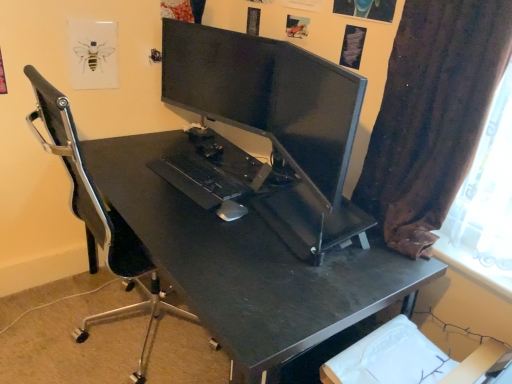
The height and width of the screenshot is (384, 512). What do you see at coordinates (250, 268) in the screenshot? I see `black matte desk at center` at bounding box center [250, 268].

You are a GUI agent. You are given a task and a screenshot of the screen. Output one action in this format:
    pyautogui.click(x=<x>, y=<y>)
    Task: Click on the white matte mouse at center
    The width and height of the screenshot is (512, 384).
    Given the screenshot: What is the action you would take?
    pyautogui.click(x=231, y=211)

At what (x,y) coordinates should I click in order to perform the action: click on black matte desk at center. Please return your answer as a coordinate pair (x, y). Looking at the image, I should click on (250, 268).

From a real-world perspective, is brown fabric curtain at right below black matte desk at center?

No, from a real-world perspective, brown fabric curtain at right is not below black matte desk at center.

Can you confirm if brown fabric curtain at right is taller than black matte desk at center?

Correct, brown fabric curtain at right is much taller as black matte desk at center.

Visually, is brown fabric curtain at right positioned to the left or to the right of black matte desk at center?

brown fabric curtain at right is to the right of black matte desk at center.

The width and height of the screenshot is (512, 384). I want to click on curtain on the right of black matte desk at center, so click(432, 115).

Which is correct: black matte desk at center is inside brown fabric curtain at right, or outside of it?

black matte desk at center is not inside brown fabric curtain at right, it's outside.

Considering the points (309, 271) and (376, 186), which point is in front, point (309, 271) or point (376, 186)?

The point (309, 271) is in front.

From a real-world perspective, relative to brown fabric curtain at right, is black matte desk at center vertically above or below?

black matte desk at center is situated lower than brown fabric curtain at right in the real world.

Considering the relative positions of black matte desk at center and brown fabric curtain at right in the image provided, is black matte desk at center to the left of brown fabric curtain at right from the viewer's perspective?

Yes.

Is brown fabric curtain at right aimed at white matte mouse at center?

No, brown fabric curtain at right is not aimed at white matte mouse at center.

Between brown fabric curtain at right and white matte mouse at center, which one has larger size?

With larger size is brown fabric curtain at right.

From the image's perspective, which object appears higher, brown fabric curtain at right or white matte mouse at center?

brown fabric curtain at right is shown above in the image.

How far apart are brown fabric curtain at right and white matte mouse at center?

brown fabric curtain at right and white matte mouse at center are 26.55 inches apart from each other.

Can you confirm if black matte desk at center is thinner than white matte mouse at center?

In fact, black matte desk at center might be wider than white matte mouse at center.

In the scene shown: From a real-world perspective, is black matte desk at center beneath white matte mouse at center?

Yes.

Would you say black matte desk at center is a long distance from white matte mouse at center?

No, black matte desk at center is in close proximity to white matte mouse at center.

Is white matte mouse at center aimed at black matte desk at center?

No.

Is white matte mouse at center in front of or behind black matte desk at center in the image?

white matte mouse at center is positioned farther from the viewer than black matte desk at center.

Based on the photo, how different are the orientations of white matte mouse at center and black matte desk at center in degrees?

The facing directions of white matte mouse at center and black matte desk at center are 3.03 degrees apart.

Identify the location of mouse above the black matte desk at center (from the image's perspective). (231, 211).

The width and height of the screenshot is (512, 384). I want to click on curtain above the white matte mouse at center (from a real-world perspective), so click(x=432, y=115).

Is white matte mouse at center oriented away from brown fabric curtain at right?

That's not correct — white matte mouse at center is not looking away from brown fabric curtain at right.

Measure the distance between white matte mouse at center and brown fabric curtain at right.

white matte mouse at center is 26.55 inches away from brown fabric curtain at right.

Are white matte mouse at center and brown fabric curtain at right located far from each other?

white matte mouse at center is near brown fabric curtain at right, not far away.

The height and width of the screenshot is (384, 512). I want to click on curtain to the right of black matte desk at center, so click(x=432, y=115).

The image size is (512, 384). What are the coordinates of `desk that is behind the brown fabric curtain at right` in the screenshot? It's located at (250, 268).

Looking at this image, when comparing their distances from black matte desk at center, does white matte mouse at center or brown fabric curtain at right seem further?

Among the two, brown fabric curtain at right is located further to black matte desk at center.

Based on their spatial positions, is black matte desk at center or white matte mouse at center closer to brown fabric curtain at right?

The object closer to brown fabric curtain at right is black matte desk at center.

From the image, which object appears to be nearer to brown fabric curtain at right, white matte mouse at center or black matte desk at center?

Among the two, black matte desk at center is located nearer to brown fabric curtain at right.

From the image, which object appears to be farther from white matte mouse at center, black matte desk at center or brown fabric curtain at right?

brown fabric curtain at right.

Which object lies nearer to the anchor point black matte desk at center, brown fabric curtain at right or white matte mouse at center?

Among the two, white matte mouse at center is located nearer to black matte desk at center.

Based on their spatial positions, is brown fabric curtain at right or black matte desk at center further from white matte mouse at center?

Based on the image, brown fabric curtain at right appears to be further to white matte mouse at center.

You are a GUI agent. You are given a task and a screenshot of the screen. Output one action in this format:
    pyautogui.click(x=<x>, y=<y>)
    Task: Click on the mouse located between black matte desk at center and brown fabric curtain at right in the left-right direction
    
    Given the screenshot: What is the action you would take?
    pyautogui.click(x=231, y=211)